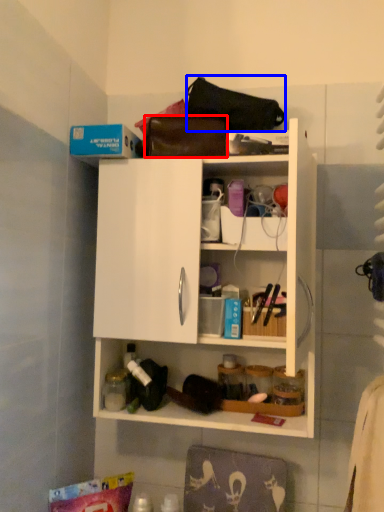
Question: Which object appears farthest to the camera in this image, handbag (highlighted by a red box) or handbag (highlighted by a blue box)?

Choices:
 (A) handbag
 (B) handbag

Answer: (A)